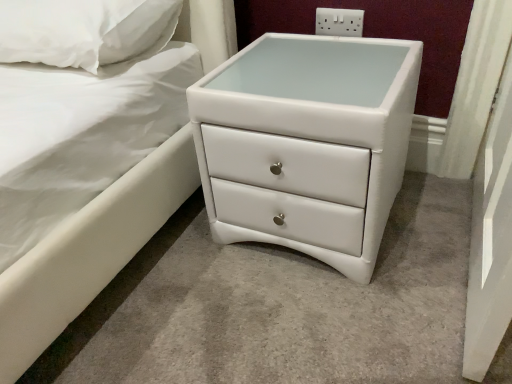
Question: Is white glossy chest of drawers at lower right at the left side of white soft pillow at upper left?

Choices:
 (A) yes
 (B) no

Answer: (B)

Question: Would you consider white glossy chest of drawers at lower right to be distant from white soft pillow at upper left?

Choices:
 (A) no
 (B) yes

Answer: (A)

Question: From a real-world perspective, is white glossy chest of drawers at lower right located beneath white soft pillow at upper left?

Choices:
 (A) yes
 (B) no

Answer: (A)

Question: Is white glossy chest of drawers at lower right shorter than white soft pillow at upper left?

Choices:
 (A) yes
 (B) no

Answer: (B)

Question: Can you confirm if white glossy chest of drawers at lower right is wider than white soft pillow at upper left?

Choices:
 (A) no
 (B) yes

Answer: (B)

Question: Is white plastic electrical outlet at upper center taller or shorter than white soft pillow at upper left?

Choices:
 (A) tall
 (B) short

Answer: (B)

Question: Is white plastic electrical outlet at upper center in front of or behind white soft pillow at upper left in the image?

Choices:
 (A) front
 (B) behind

Answer: (B)

Question: Which is correct: white plastic electrical outlet at upper center is inside white soft pillow at upper left, or outside of it?

Choices:
 (A) outside
 (B) inside

Answer: (A)

Question: Looking at the image, does white plastic electrical outlet at upper center seem bigger or smaller compared to white soft pillow at upper left?

Choices:
 (A) small
 (B) big

Answer: (A)

Question: In terms of height, does white glossy chest of drawers at lower right look taller or shorter compared to white plastic electrical outlet at upper center?

Choices:
 (A) tall
 (B) short

Answer: (A)

Question: Considering the positions of point (353, 210) and point (340, 11), is point (353, 210) closer or farther from the camera than point (340, 11)?

Choices:
 (A) farther
 (B) closer

Answer: (B)

Question: Based on their positions, is white glossy chest of drawers at lower right located to the left or right of white plastic electrical outlet at upper center?

Choices:
 (A) right
 (B) left

Answer: (B)

Question: Considering the positions of white glossy chest of drawers at lower right and white plastic electrical outlet at upper center in the image, is white glossy chest of drawers at lower right bigger or smaller than white plastic electrical outlet at upper center?

Choices:
 (A) big
 (B) small

Answer: (A)

Question: Do you think white soft pillow at upper left is within white glossy chest of drawers at lower right, or outside of it?

Choices:
 (A) outside
 (B) inside

Answer: (A)

Question: Considering their positions, is white soft pillow at upper left located in front of or behind white glossy chest of drawers at lower right?

Choices:
 (A) behind
 (B) front

Answer: (A)